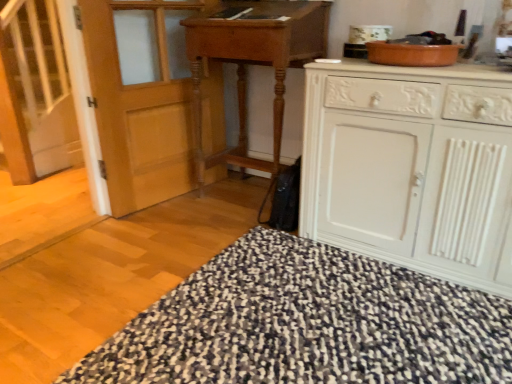
You are a GUI agent. You are given a task and a screenshot of the screen. Output one action in this format:
    pyautogui.click(x=<x>, y=<y>)
    Task: Click on the empty space that is ontop of black textured rug at lower center (from a real-world perspective)
    The height and width of the screenshot is (384, 512).
    Given the screenshot: What is the action you would take?
    pyautogui.click(x=304, y=317)